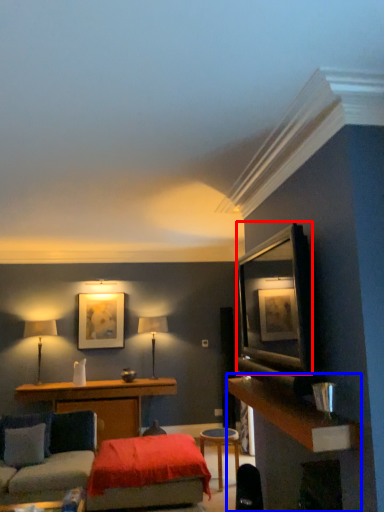
Question: Which object is closer to the camera taking this photo, shelf (highlighted by a red box) or dresser (highlighted by a blue box)?

Choices:
 (A) shelf
 (B) dresser

Answer: (B)